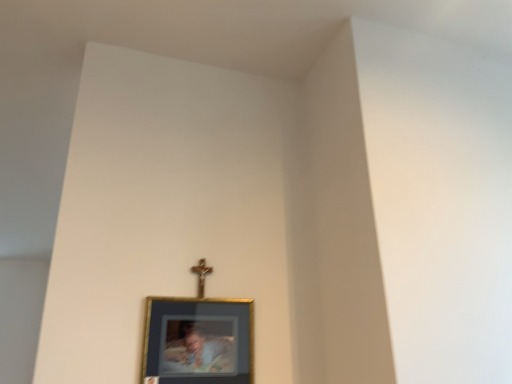
This screenshot has width=512, height=384. I want to click on gold-framed picture at center, so click(198, 341).

Looking at this image, measure the distance between gold-framed picture at center and camera.

gold-framed picture at center is 1.16 meters away from camera.

The height and width of the screenshot is (384, 512). What do you see at coordinates (198, 341) in the screenshot? I see `gold-framed picture at center` at bounding box center [198, 341].

The width and height of the screenshot is (512, 384). Identify the location of gold-framed picture at center. (198, 341).